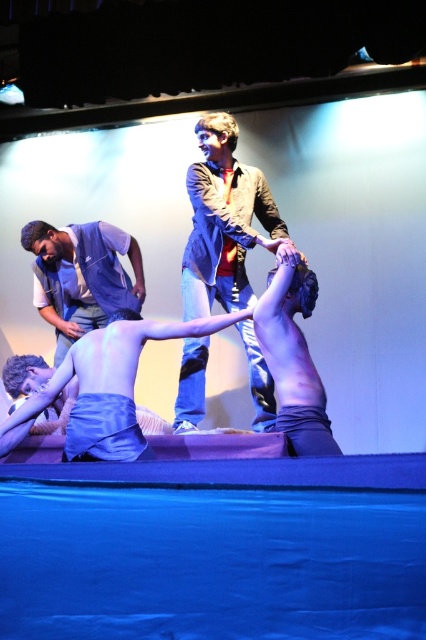
Between smooth skin torso at center and denim vest at left, which one has more height?

denim vest at left is taller.

Does smooth skin torso at center appear under denim vest at left?

Yes, smooth skin torso at center is below denim vest at left.

The image size is (426, 640). Identify the location of smooth skin torso at center. (106, 387).

Between denim jacket at upper center and denim vest at left, which one is positioned higher?

Positioned higher is denim jacket at upper center.

Does denim jacket at upper center appear under denim vest at left?

Incorrect, denim jacket at upper center is not positioned below denim vest at left.

Who is more distant from viewer, (261, 371) or (66, 246)?

Point (66, 246)

Where is `denim jacket at upper center`? denim jacket at upper center is located at coordinates (224, 221).

From the picture: Can you confirm if denim jacket at upper center is wider than smooth skin torso at center?

No, denim jacket at upper center is not wider than smooth skin torso at center.

Who is more forward, (218, 269) or (166, 330)?

Point (166, 330) is more forward.

Between point (273, 417) and point (58, 378), which one is positioned behind?

Point (273, 417)

Locate an element on the screen. denim jacket at upper center is located at coordinates (224, 221).